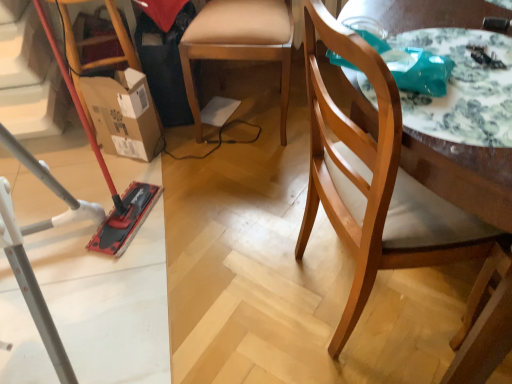
At what (x,y) coordinates should I click in order to perform the action: click on free location in front of light brown wooden chair at center, the 2th chair in the front-to-back sequence. Please return your answer as a coordinate pair (x, y). The height and width of the screenshot is (384, 512). Looking at the image, I should click on click(239, 192).